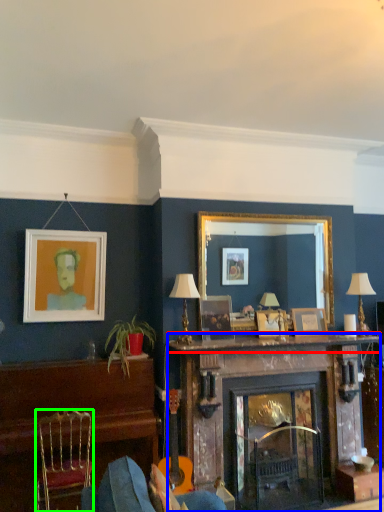
Question: Which object is the closest to the mantle (highlighted by a red box)? Choose among these: fireplace (highlighted by a blue box) or chair (highlighted by a green box).

Choices:
 (A) fireplace
 (B) chair

Answer: (A)